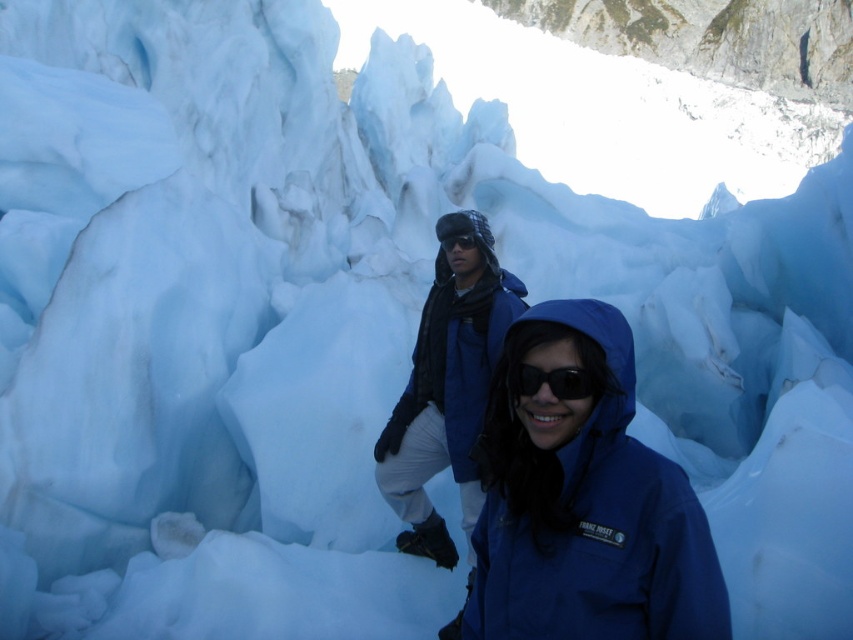
Can you confirm if blue matte jacket at center is wider than transparent plastic goggles at center?

Correct, the width of blue matte jacket at center exceeds that of transparent plastic goggles at center.

Who is lower down, blue matte jacket at center or transparent plastic goggles at center?

blue matte jacket at center is lower down.

You are a GUI agent. You are given a task and a screenshot of the screen. Output one action in this format:
    pyautogui.click(x=<x>, y=<y>)
    Task: Click on the blue matte jacket at center
    The image size is (853, 640).
    Given the screenshot: What is the action you would take?
    pyautogui.click(x=585, y=502)

Who is positioned more to the left, blue matte jacket at center or black reflective sunglasses at center?

black reflective sunglasses at center

Is point (627, 483) positioned in front of point (595, 385)?

Yes.

Identify the location of blue matte jacket at center. This screenshot has width=853, height=640. (585, 502).

Can you confirm if blue matte jacket at center is shorter than matte blue jacket at center?

Correct, blue matte jacket at center is not as tall as matte blue jacket at center.

Between blue matte jacket at center and matte blue jacket at center, which one is positioned lower?

Positioned lower is blue matte jacket at center.

Which is in front, point (670, 529) or point (399, 420)?

Point (670, 529) is in front.

This screenshot has width=853, height=640. Find the location of `blue matte jacket at center`. blue matte jacket at center is located at coordinates (585, 502).